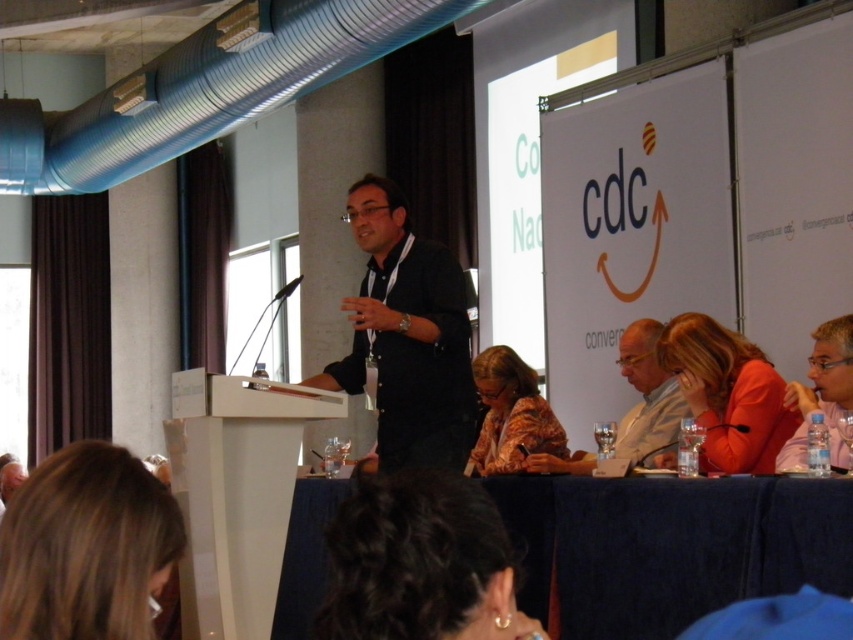
You are a photographer adjusting your camera settings. You notice two points in the image at coordinates point (625, 573) and point (84, 570). If you want to focus on the point that is closer to the camera, which coordinate should you choose?

You should focus on point (84, 570) because it is closer to the camera than point (625, 573).

You are organizing a small event and need to place a 1.20 meter wide table between the blue fabric table at lower center and the large screen. Is there enough space to fit the table without moving the existing furniture?

The distance between the blue fabric table at lower center and the large screen is 13.70 meters. Since the table is only 1.20 meters wide, there is sufficient space to place it between them without moving existing furniture.

You are attending a conference and need to identify the speaker based on their clothing. The speaker is wearing a matte black shirt at center. Is the floral fabric jacket at lower center part of the speaker or someone else?

The floral fabric jacket at lower center is below the matte black shirt at center, so it belongs to the speaker wearing the matte black shirt at center.